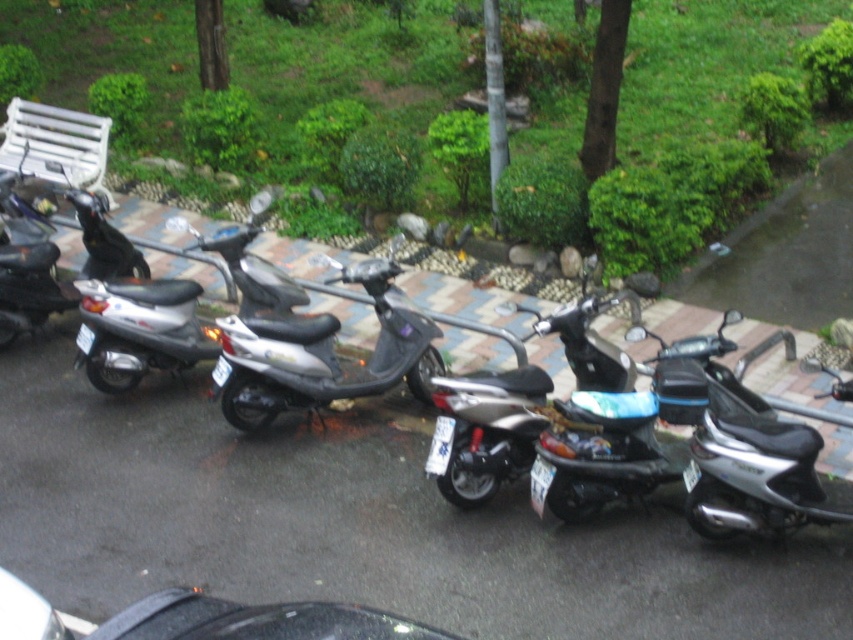
Can you confirm if satin black scooter at center is taller than white plastic bench at upper left?

Yes, satin black scooter at center is taller than white plastic bench at upper left.

From the picture: Between satin black scooter at center and white plastic bench at upper left, which one appears on the right side from the viewer's perspective?

From the viewer's perspective, satin black scooter at center appears more on the right side.

I want to click on satin black scooter at center, so click(x=322, y=353).

Does black glossy car at lower center have a larger size compared to silver metallic scooter at left?

Incorrect, black glossy car at lower center is not larger than silver metallic scooter at left.

Measure the distance between black glossy car at lower center and silver metallic scooter at left.

5.15 meters

Locate an element on the screen. Image resolution: width=853 pixels, height=640 pixels. black glossy car at lower center is located at coordinates [x=254, y=620].

Does matte black scooter at left appear on the left side of satin black scooter at center?

Correct, you'll find matte black scooter at left to the left of satin black scooter at center.

In the scene shown: Does matte black scooter at left have a greater width compared to satin black scooter at center?

Yes, matte black scooter at left is wider than satin black scooter at center.

Who is more forward, [410,33] or [419,362]?

Positioned in front is point [419,362].

Identify the location of matte black scooter at left. (345, 65).